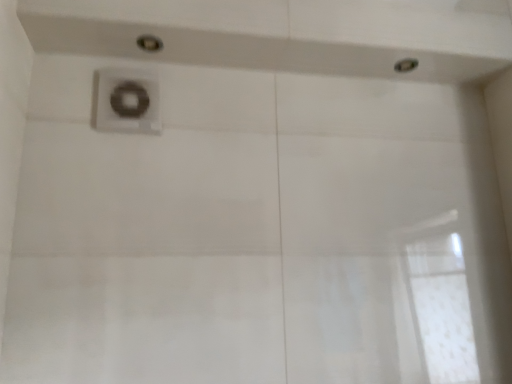
Question: From a real-world perspective, is satin nickel faucet at upper center above or below metallic silver showerhead at upper right, which is the 1th shower in right-to-left order?

Choices:
 (A) above
 (B) below

Answer: (B)

Question: Is satin nickel faucet at upper center inside the boundaries of metallic silver showerhead at upper right, which is the 2th shower from front to back, or outside?

Choices:
 (A) outside
 (B) inside

Answer: (A)

Question: Estimate the real-world distances between objects in this image. Which object is closer to the metallic silver showerhead at upper right, which is the 1th shower in right-to-left order?

Choices:
 (A) matte silver shower at upper center, which ranks as the second shower in right-to-left order
 (B) satin nickel faucet at upper center

Answer: (A)

Question: Estimate the real-world distances between objects in this image. Which object is closer to the satin nickel faucet at upper center?

Choices:
 (A) matte silver shower at upper center, which ranks as the second shower in right-to-left order
 (B) metallic silver showerhead at upper right, arranged as the second shower when viewed from the left

Answer: (A)